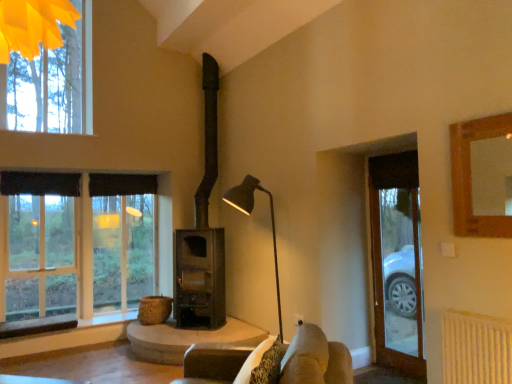
Question: Would you say clear glass door at right is a long distance from black metal floor lamp at center?

Choices:
 (A) no
 (B) yes

Answer: (B)

Question: Can you confirm if clear glass door at right is thinner than black metal floor lamp at center?

Choices:
 (A) yes
 (B) no

Answer: (A)

Question: From the image's perspective, is clear glass door at right under black metal floor lamp at center?

Choices:
 (A) no
 (B) yes

Answer: (A)

Question: Is clear glass door at right bigger than black metal floor lamp at center?

Choices:
 (A) yes
 (B) no

Answer: (B)

Question: Is black metal floor lamp at center at the back of clear glass door at right?

Choices:
 (A) yes
 (B) no

Answer: (B)

Question: Considering the positions of smooth stone table at center and clear glass door at right in the image, is smooth stone table at center bigger or smaller than clear glass door at right?

Choices:
 (A) big
 (B) small

Answer: (A)

Question: From a real-world perspective, is smooth stone table at center physically located above or below clear glass door at right?

Choices:
 (A) above
 (B) below

Answer: (B)

Question: From the image's perspective, is smooth stone table at center located above or below clear glass door at right?

Choices:
 (A) below
 (B) above

Answer: (A)

Question: From their relative heights in the image, would you say smooth stone table at center is taller or shorter than clear glass door at right?

Choices:
 (A) tall
 (B) short

Answer: (B)

Question: Considering their positions, is clear glass door at right located in front of or behind matte glass window at left?

Choices:
 (A) behind
 (B) front

Answer: (B)

Question: Considering the positions of clear glass door at right and matte glass window at left in the image, is clear glass door at right taller or shorter than matte glass window at left?

Choices:
 (A) tall
 (B) short

Answer: (A)

Question: Is clear glass door at right wider or thinner than matte glass window at left?

Choices:
 (A) wide
 (B) thin

Answer: (B)

Question: Is point (414, 355) positioned closer to the camera than point (48, 231)?

Choices:
 (A) farther
 (B) closer

Answer: (B)

Question: Considering the positions of matte black fireplace at center and black metal floor lamp at center in the image, is matte black fireplace at center bigger or smaller than black metal floor lamp at center?

Choices:
 (A) big
 (B) small

Answer: (A)

Question: Would you say matte black fireplace at center is inside or outside black metal floor lamp at center?

Choices:
 (A) inside
 (B) outside

Answer: (B)